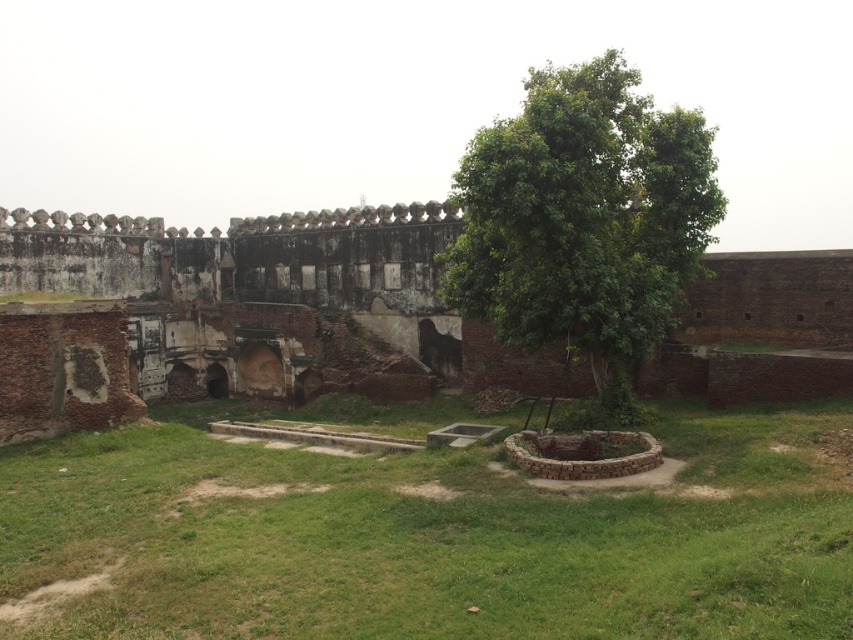
Question: In this image, where is green grass at center located relative to green leafy tree at center?

Choices:
 (A) left
 (B) right

Answer: (A)

Question: Among these points, which one is farthest from the camera?

Choices:
 (A) (718, 401)
 (B) (577, 168)

Answer: (A)

Question: Is green grass at center thinner than weathered brick palace at center?

Choices:
 (A) yes
 (B) no

Answer: (A)

Question: Based on their relative distances, which object is farther from the green grass at center?

Choices:
 (A) weathered brick palace at center
 (B) green leafy tree at center

Answer: (B)

Question: Which of these objects is positioned farthest from the green grass at center?

Choices:
 (A) green leafy tree at center
 (B) weathered brick palace at center

Answer: (A)

Question: Considering the relative positions of green grass at center and green leafy tree at center in the image provided, where is green grass at center located with respect to green leafy tree at center?

Choices:
 (A) above
 (B) below

Answer: (B)